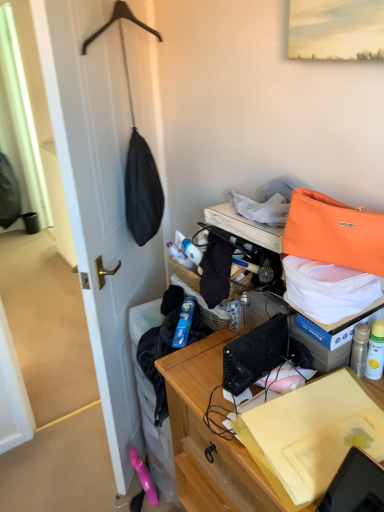
Question: From a real-world perspective, is wooden desk at center positioned above or below matte black coat hanger at left?

Choices:
 (A) above
 (B) below

Answer: (B)

Question: Is wooden desk at center to the left or to the right of matte black coat hanger at left in the image?

Choices:
 (A) right
 (B) left

Answer: (A)

Question: Which object is the closest to the orange leather handbag at upper right?

Choices:
 (A) wooden desk at center
 (B) white matte box at upper right
 (C) orange leather handbag at upper right
 (D) matte black coat hanger at left

Answer: (C)

Question: Based on their relative distances, which object is farther from the orange leather handbag at upper right?

Choices:
 (A) orange leather handbag at upper right
 (B) matte black coat hanger at left
 (C) wooden desk at center
 (D) white matte box at upper right

Answer: (B)